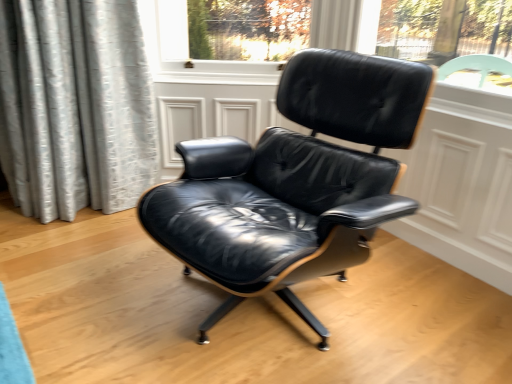
The image size is (512, 384). Describe the element at coordinates (210, 113) in the screenshot. I see `black leather screen door at center` at that location.

Image resolution: width=512 pixels, height=384 pixels. I want to click on black leather screen door at center, so click(210, 113).

Find the location of a particular element. This screenshot has width=512, height=384. black leather chair at center is located at coordinates (295, 182).

Image resolution: width=512 pixels, height=384 pixels. What do you see at coordinates (295, 182) in the screenshot?
I see `black leather chair at center` at bounding box center [295, 182].

You are a GUI agent. You are given a task and a screenshot of the screen. Output one action in this format:
    pyautogui.click(x=<x>, y=<y>)
    Task: Click on the black leather screen door at center
    The height and width of the screenshot is (384, 512).
    Given the screenshot: What is the action you would take?
    click(x=210, y=113)

Does black leather chair at center appear on the right side of black leather screen door at center?

Yes.

Considering the positions of objects black leather chair at center and black leather screen door at center in the image provided, who is in front, black leather chair at center or black leather screen door at center?

black leather chair at center is in front.

Which is nearer, (340, 275) or (200, 93)?

Clearly, point (340, 275) is closer to the camera than point (200, 93).

Consider the image. From the image's perspective, does black leather chair at center appear higher than black leather screen door at center?

No, from the image's perspective, black leather chair at center is not above black leather screen door at center.

From a real-world perspective, is black leather chair at center located higher than black leather screen door at center?

Indeed, from a real-world perspective, black leather chair at center stands above black leather screen door at center.

Which of these two, black leather chair at center or black leather screen door at center, is wider?

A: Wider between the two is black leather chair at center.

Considering the relative sizes of black leather chair at center and black leather screen door at center in the image provided, is black leather chair at center taller than black leather screen door at center?

Correct, black leather chair at center is much taller as black leather screen door at center.

Considering the sizes of objects black leather chair at center and black leather screen door at center in the image provided, who is bigger, black leather chair at center or black leather screen door at center?

black leather chair at center.

Is black leather chair at center completely or partially outside of black leather screen door at center?

Yes, black leather chair at center is outside of black leather screen door at center.

Are black leather chair at center and black leather screen door at center located far from each other?

No.

Is black leather chair at center aimed at black leather screen door at center?

No.

How many degrees apart are the facing directions of black leather chair at center and black leather screen door at center?

47.3 degrees separate the facing orientations of black leather chair at center and black leather screen door at center.

Measure the distance from black leather chair at center to black leather screen door at center.

black leather chair at center is 28.94 inches away from black leather screen door at center.

In the image, there is a black leather chair at center. Where is `screen door below it (from a real-world perspective)`? This screenshot has height=384, width=512. screen door below it (from a real-world perspective) is located at coordinates (210, 113).

Which object is positioned more to the left, black leather screen door at center or black leather chair at center?

black leather screen door at center.

Relative to black leather chair at center, is black leather screen door at center in front or behind?

In the image, black leather screen door at center appears behind black leather chair at center.

Which is in front, point (195, 94) or point (303, 229)?

The point (303, 229) is closer to the camera.

Consider the image. From the image's perspective, which one is positioned lower, black leather screen door at center or black leather chair at center?

black leather chair at center appears lower in the image.

In the scene shown: From a real-world perspective, which is physically above, black leather screen door at center or black leather chair at center?

From a 3D spatial view, black leather chair at center is above.

Can you confirm if black leather screen door at center is thinner than black leather chair at center?

Yes.

Considering the relative sizes of black leather screen door at center and black leather chair at center in the image provided, is black leather screen door at center taller than black leather chair at center?

Incorrect, the height of black leather screen door at center is not larger of that of black leather chair at center.

Considering the relative sizes of black leather screen door at center and black leather chair at center in the image provided, is black leather screen door at center smaller than black leather chair at center?

Indeed, black leather screen door at center has a smaller size compared to black leather chair at center.

Is black leather chair at center completely or partially inside black leather screen door at center?

That's incorrect, black leather chair at center is not inside black leather screen door at center.

Is black leather screen door at center far away from black leather chair at center?

black leather screen door at center is actually quite close to black leather chair at center.

Is black leather screen door at center facing towards black leather chair at center?

Yes.

How many degrees apart are the facing directions of black leather screen door at center and black leather chair at center?

The angle between the facing direction of black leather screen door at center and the facing direction of black leather chair at center is 47.3 degrees.

I want to click on chair below the black leather screen door at center (from the image's perspective), so click(x=295, y=182).

Locate an element on the screen. This screenshot has width=512, height=384. screen door that is on the left side of black leather chair at center is located at coordinates (210, 113).

This screenshot has height=384, width=512. Find the location of `chair below the black leather screen door at center (from the image's perspective)`. chair below the black leather screen door at center (from the image's perspective) is located at coordinates (295, 182).